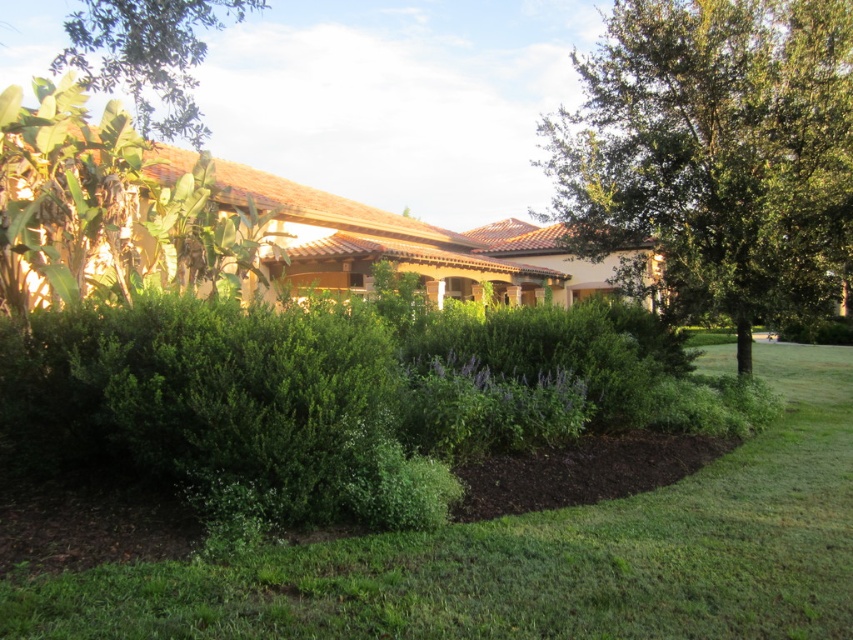
Question: In this image, where is green leafy tree at upper right located relative to green leafy tree at upper left?

Choices:
 (A) below
 (B) above

Answer: (A)

Question: Which point is closer to the camera taking this photo?

Choices:
 (A) (126, 22)
 (B) (782, 252)

Answer: (A)

Question: Does green leafy tree at upper right lie in front of green leafy tree at upper left?

Choices:
 (A) no
 (B) yes

Answer: (A)

Question: Which point is closer to the camera?

Choices:
 (A) (799, 205)
 (B) (96, 32)

Answer: (A)

Question: Which point appears closest to the camera in this image?

Choices:
 (A) (556, 118)
 (B) (19, 614)

Answer: (B)

Question: Does green leafy tree at upper right appear over green leafy tree at upper left?

Choices:
 (A) yes
 (B) no

Answer: (B)